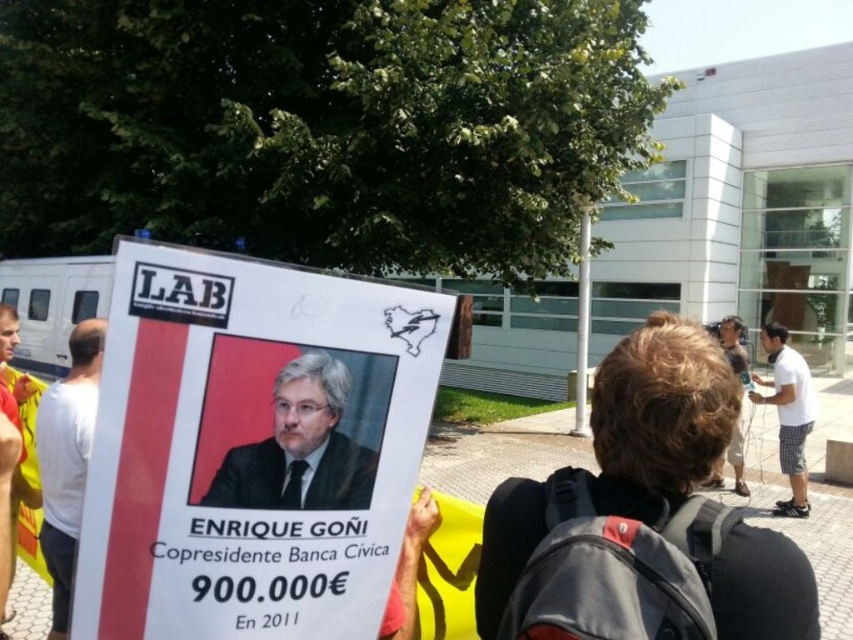
You are a photographer trying to capture both the white paper poster at center and the light brown hair at right in a single frame. Which object should you adjust your camera angle to focus on first to ensure both are in the frame?

The white paper poster at center is thinner than light brown hair at right, so you should focus on the light brown hair at right first to ensure both fit within the frame.